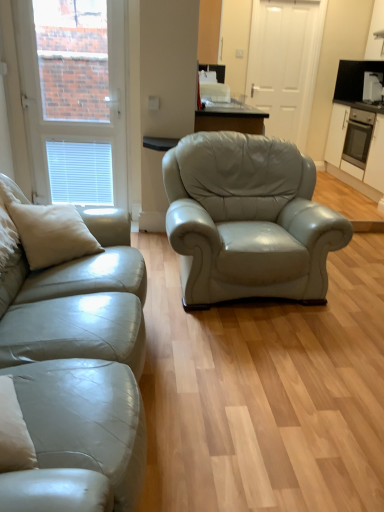
The width and height of the screenshot is (384, 512). Describe the element at coordinates (285, 63) in the screenshot. I see `white matte door at center` at that location.

Identify the location of white matte cabinet at right. (368, 153).

Image resolution: width=384 pixels, height=512 pixels. What are the coordinates of `satin beige leather couch at left` in the screenshot? It's located at (76, 357).

What do you see at coordinates (49, 231) in the screenshot? I see `beige leather pillow at left` at bounding box center [49, 231].

Identify the location of white matte window at upper left. (74, 99).

Is satin beige leather couch at left to the right of white matte window at upper left from the viewer's perspective?

Yes.

Is satin beige leather couch at left bigger than white matte window at upper left?

Indeed, satin beige leather couch at left has a larger size compared to white matte window at upper left.

Which object is further away from the camera taking this photo, satin beige leather couch at left or white matte window at upper left?

Positioned behind is white matte window at upper left.

Locate an element on the screen. appliance behind the beige leather pillow at left is located at coordinates (x=372, y=86).

Which object is closer to the camera taking this photo, white glossy toaster at upper right or beige leather pillow at left?

beige leather pillow at left is in front.

Is white glossy toaster at upper right positioned far away from beige leather pillow at left?

Yes, white glossy toaster at upper right and beige leather pillow at left are quite far apart.

From a real-world perspective, does white glossy toaster at upper right stand above beige leather pillow at left?

Indeed, from a real-world perspective, white glossy toaster at upper right stands above beige leather pillow at left.

Which of these two, white matte cabinet at right or white glossy toaster at upper right, is bigger?

white matte cabinet at right is bigger.

From the image's perspective, would you say white matte cabinet at right is shown under white glossy toaster at upper right?

Yes, from the image's perspective, white matte cabinet at right is beneath white glossy toaster at upper right.

Is white matte cabinet at right located outside white glossy toaster at upper right?

Yes, white matte cabinet at right is outside of white glossy toaster at upper right.

Which of these two, satin beige leather couch at left or beige leather pillow at left, is smaller?

Smaller between the two is beige leather pillow at left.

How much distance is there between satin beige leather couch at left and beige leather pillow at left?

31.14 centimeters.

Is satin beige leather couch at left aimed at beige leather pillow at left?

Yes, satin beige leather couch at left is oriented towards beige leather pillow at left.

Are satin beige leather couch at left and beige leather pillow at left located far from each other?

That's not correct — satin beige leather couch at left is a little close to beige leather pillow at left.

How different are the orientations of beige leather pillow at left and satin beige leather couch at left in degrees?

58.3 degrees.

Which of these two, beige leather pillow at left or satin beige leather couch at left, is thinner?

With smaller width is beige leather pillow at left.

From the image's perspective, relative to satin beige leather couch at left, is beige leather pillow at left above or below?

Based on their image positions, beige leather pillow at left is located above satin beige leather couch at left.

Looking at this image, are beige leather pillow at left and satin beige leather couch at left far apart?

No, there isn't a large distance between beige leather pillow at left and satin beige leather couch at left.

Between point (373, 173) and point (124, 390), which one is positioned behind?

Point (373, 173)

Does white matte cabinet at right contain satin beige leather couch at left?

No, white matte cabinet at right does not contain satin beige leather couch at left.

From the image's perspective, which one is positioned higher, white matte cabinet at right or satin beige leather couch at left?

white matte cabinet at right is shown above in the image.

Is white matte cabinet at right facing towards satin beige leather couch at left?

No, white matte cabinet at right is not turned towards satin beige leather couch at left.

Considering the relative sizes of satin beige leather couch at left and white glossy toaster at upper right in the image provided, is satin beige leather couch at left thinner than white glossy toaster at upper right?

In fact, satin beige leather couch at left might be wider than white glossy toaster at upper right.

Considering the relative positions of satin beige leather couch at left and white glossy toaster at upper right in the image provided, is satin beige leather couch at left behind white glossy toaster at upper right?

No, satin beige leather couch at left is in front of white glossy toaster at upper right.

Is satin beige leather couch at left oriented away from white glossy toaster at upper right?

No.

Could white glossy toaster at upper right be considered to be inside satin beige leather couch at left?

No, white glossy toaster at upper right is not inside satin beige leather couch at left.

Image resolution: width=384 pixels, height=512 pixels. What are the coordinates of `studio couch that appears below the white matte window at upper left (from the image's perspective)` in the screenshot? It's located at (76, 357).

At what (x,y) coordinates should I click in order to perform the action: click on pillow that appears in front of the white glossy toaster at upper right. Please return your answer as a coordinate pair (x, y). The height and width of the screenshot is (512, 384). Looking at the image, I should click on (49, 231).

Considering their positions, is beige leather pillow at left positioned further to white matte door at center than satin beige leather couch at left?

Based on the image, satin beige leather couch at left appears to be further to white matte door at center.

Estimate the real-world distances between objects in this image. Which object is closer to white matte door at center, white glossy toaster at upper right or white matte cabinet at right?

white matte cabinet at right.

Estimate the real-world distances between objects in this image. Which object is further from beige leather pillow at left, satin beige leather couch at left or white matte door at center?

Among the two, white matte door at center is located further to beige leather pillow at left.

From the picture: When comparing their distances from white glossy toaster at upper right, does beige leather pillow at left or white matte cabinet at right seem further?

beige leather pillow at left is positioned further to the anchor white glossy toaster at upper right.

Considering their positions, is white glossy toaster at upper right positioned further to white matte window at upper left than satin beige leather couch at left?

white glossy toaster at upper right.

In the scene shown: Which object lies nearer to the anchor point white matte cabinet at right, beige leather pillow at left or white matte window at upper left?

white matte window at upper left is closer to white matte cabinet at right.

When comparing their distances from satin beige leather couch at left, does beige leather pillow at left or white matte cabinet at right seem further?

white matte cabinet at right lies further to satin beige leather couch at left than the other object.

Based on their spatial positions, is satin beige leather couch at left or beige leather pillow at left closer to white matte cabinet at right?

Based on the image, beige leather pillow at left appears to be nearer to white matte cabinet at right.

The width and height of the screenshot is (384, 512). Find the location of `window between satin beige leather couch at left and white matte cabinet at right along the z-axis`. window between satin beige leather couch at left and white matte cabinet at right along the z-axis is located at coordinates (74, 99).

Image resolution: width=384 pixels, height=512 pixels. In order to click on screen door located between satin beige leather couch at left and white glossy toaster at upper right in the depth direction in this screenshot , I will do `click(285, 63)`.

You are a GUI agent. You are given a task and a screenshot of the screen. Output one action in this format:
    pyautogui.click(x=<x>, y=<y>)
    Task: Click on the pillow between satin beige leather couch at left and white glossy toaster at upper right along the z-axis
    
    Given the screenshot: What is the action you would take?
    pyautogui.click(x=49, y=231)

I want to click on screen door between white matte window at upper left and white matte cabinet at right, so click(285, 63).